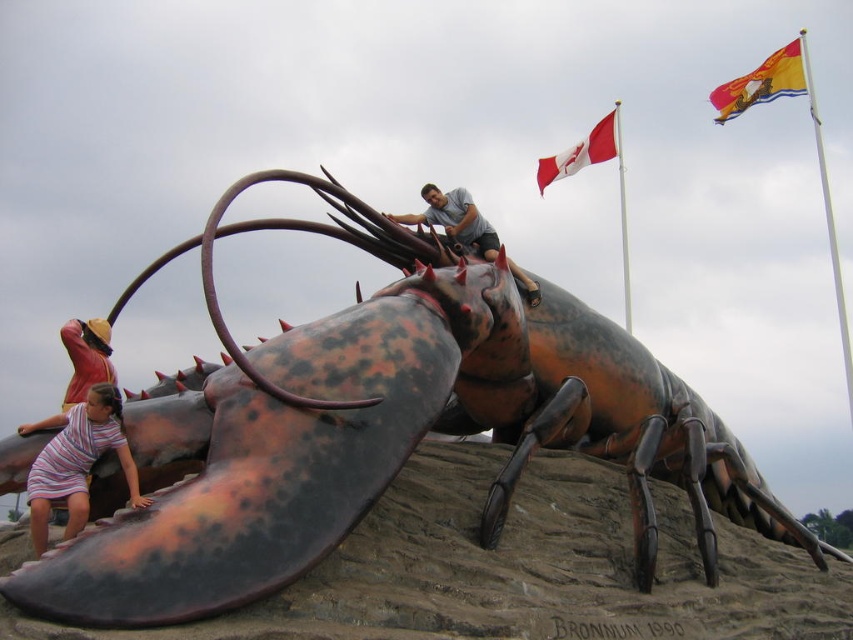
Question: Does rustic metal lobster at center have a greater width compared to red fabric flag at upper center?

Choices:
 (A) yes
 (B) no

Answer: (A)

Question: Is polyester flag at upper right bigger than red fabric flag at upper center?

Choices:
 (A) no
 (B) yes

Answer: (B)

Question: Which object is closer to the camera taking this photo?

Choices:
 (A) rustic metal lobster at center
 (B) red fabric flag at upper center
 (C) polyester flag at upper right
 (D) reddish-brown leather hat at lower left

Answer: (A)

Question: Can you confirm if striped fabric dress at lower left is bigger than reddish-brown leather hat at lower left?

Choices:
 (A) no
 (B) yes

Answer: (B)

Question: Which of the following is the closest to the observer?

Choices:
 (A) striped fabric dress at lower left
 (B) matte gray shirt at upper center

Answer: (A)

Question: Among these objects, which one is farthest from the camera?

Choices:
 (A) rustic metal lobster at center
 (B) matte gray shirt at upper center
 (C) polyester flag at upper right

Answer: (C)